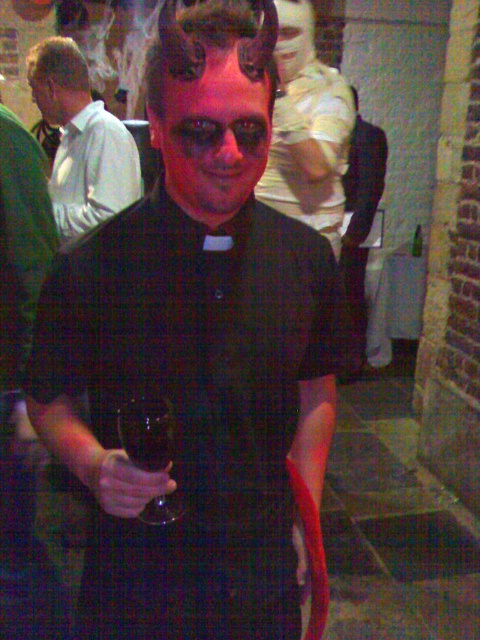
Does point (68, 356) come in front of point (110, 477)?

That is False.

Between point (139, 332) and point (152, 488), which one is positioned in front?

Point (152, 488) is in front.

I want to click on black matte shirt at center, so click(193, 406).

Can you confirm if matte black shirt at center is wider than matte white shirt at left?

Incorrect, matte black shirt at center's width does not surpass matte white shirt at left's.

Is matte black shirt at center below matte white shirt at left?

Yes, matte black shirt at center is below matte white shirt at left.

Is point (316, 214) behind point (118, 140)?

No, it is in front of (118, 140).

You are a GUI agent. You are given a task and a screenshot of the screen. Output one action in this format:
    pyautogui.click(x=<x>, y=<y>)
    Task: Click on the matte black shirt at center
    This screenshot has width=480, height=640.
    Given the screenshot: What is the action you would take?
    pyautogui.click(x=307, y=129)

Which is below, matte black shirt at center or matte black wine glass at center?

matte black wine glass at center is below.

Describe the element at coordinates (307, 129) in the screenshot. I see `matte black shirt at center` at that location.

You are a GUI agent. You are given a task and a screenshot of the screen. Output one action in this format:
    pyautogui.click(x=<x>, y=<y>)
    Task: Click on the matte black shirt at center
    Image resolution: width=480 pixels, height=640 pixels.
    Given the screenshot: What is the action you would take?
    pyautogui.click(x=307, y=129)